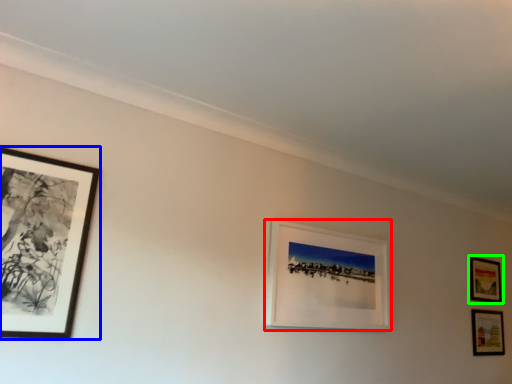
Question: Based on their relative distances, which object is nearer to picture frame (highlighted by a red box)? Choose from picture frame (highlighted by a blue box) and picture frame (highlighted by a green box).

Choices:
 (A) picture frame
 (B) picture frame

Answer: (A)